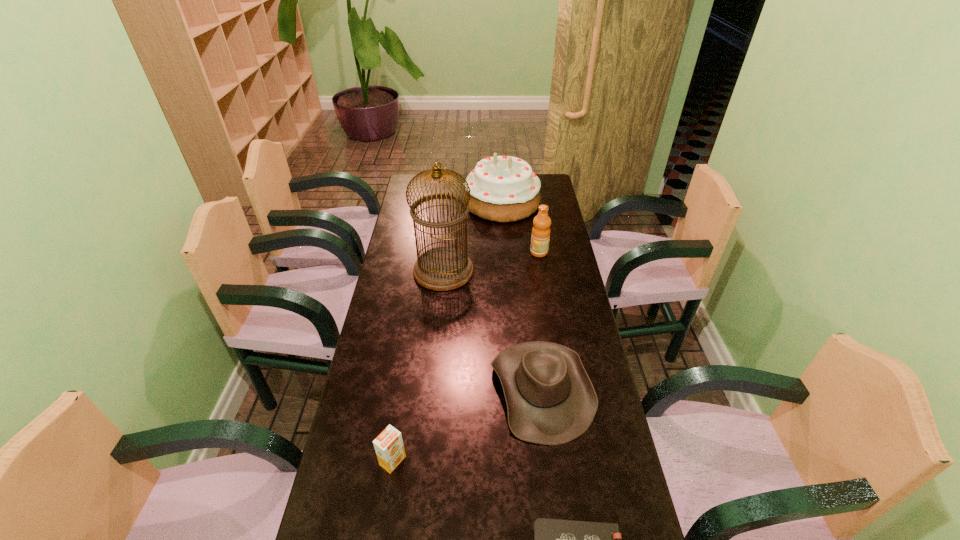
Locate an element on the screen. This screenshot has height=540, width=960. vacant space at the right edge is located at coordinates (583, 458).

Identify the location of empty space between the orange juice and the fruit juice. (466, 356).

Find the location of a particular element. The image size is (960, 540). free space that is in between the cake and the orange juice is located at coordinates [x=447, y=332].

Where is `unoccupied area between the tallest object and the cowboy hat`? The height and width of the screenshot is (540, 960). unoccupied area between the tallest object and the cowboy hat is located at coordinates (492, 329).

The height and width of the screenshot is (540, 960). I want to click on free space between the fruit juice and the orange juice, so click(x=466, y=356).

Locate an element on the screen. Image resolution: width=960 pixels, height=540 pixels. vacant space in between the birdcage and the cowboy hat is located at coordinates (492, 329).

In order to click on the closest object to the orange juice in this screenshot , I will do `click(550, 398)`.

Identify the location of object that is the closest to the notebook. Image resolution: width=960 pixels, height=540 pixels. (550, 398).

The height and width of the screenshot is (540, 960). Identify the location of vacant space that satisfies the following two spatial constraints: 1. on the label side of the fruit juice; 2. on the front side of the second nearest object. (573, 461).